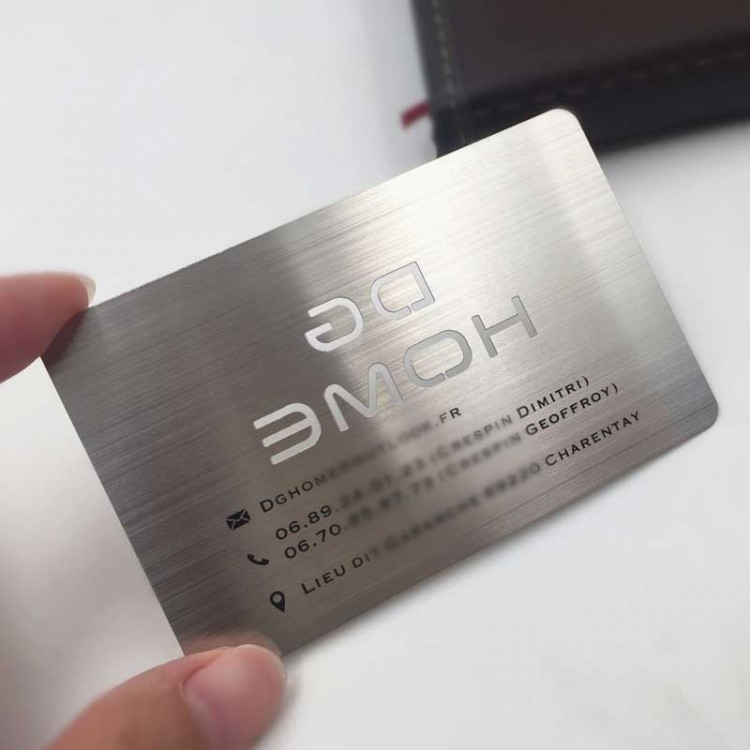
This screenshot has width=750, height=750. Identify the location of rounded corners. (562, 112), (712, 411).